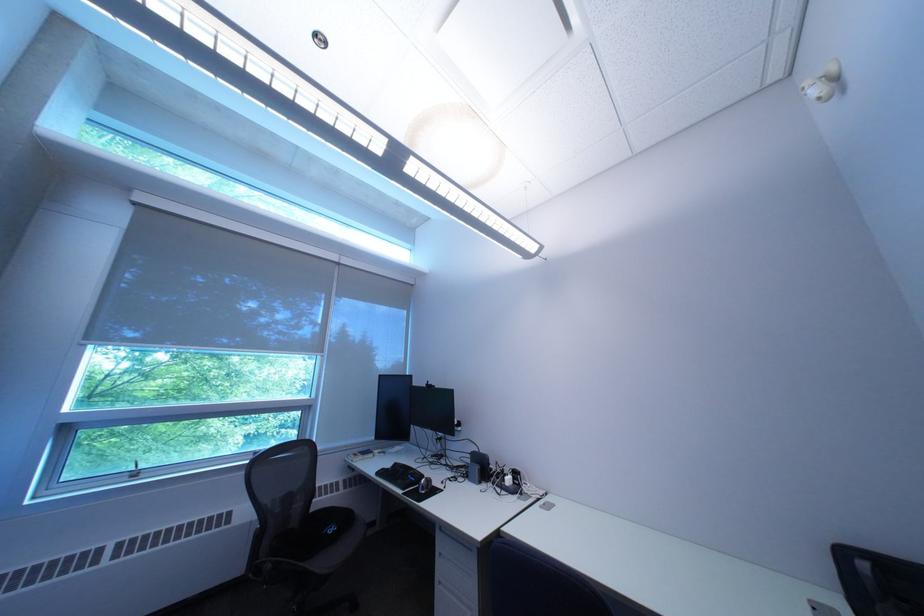
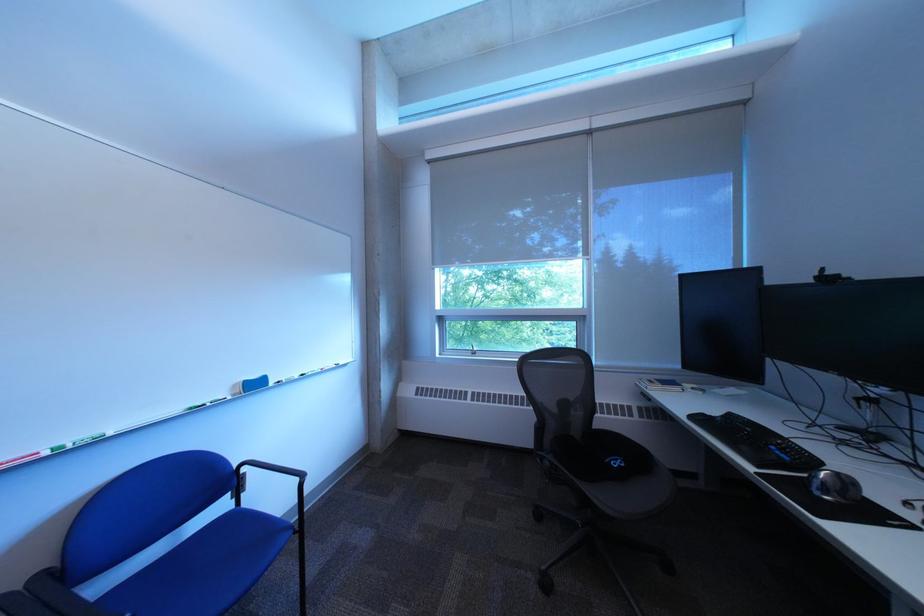
Find the pixel in the second image that matches (444,386) in the first image.

(843, 275)